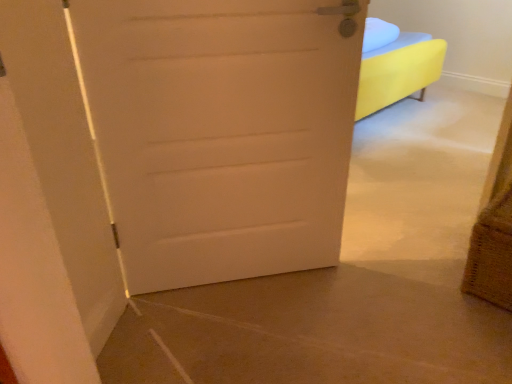
Question: Can you confirm if white matte door at center is shorter than burlap basket at lower right?

Choices:
 (A) yes
 (B) no

Answer: (B)

Question: Does white matte door at center contain burlap basket at lower right?

Choices:
 (A) no
 (B) yes

Answer: (A)

Question: Is white matte door at center behind burlap basket at lower right?

Choices:
 (A) no
 (B) yes

Answer: (A)

Question: Would you consider white matte door at center to be distant from burlap basket at lower right?

Choices:
 (A) yes
 (B) no

Answer: (B)

Question: Is white matte door at center wider than burlap basket at lower right?

Choices:
 (A) yes
 (B) no

Answer: (B)

Question: Is white matte door at center thinner than burlap basket at lower right?

Choices:
 (A) yes
 (B) no

Answer: (A)

Question: Does burlap basket at lower right have a greater width compared to white matte door at center?

Choices:
 (A) no
 (B) yes

Answer: (B)

Question: Is burlap basket at lower right far from white matte door at center?

Choices:
 (A) no
 (B) yes

Answer: (A)

Question: Is burlap basket at lower right oriented towards white matte door at center?

Choices:
 (A) yes
 (B) no

Answer: (B)

Question: Is burlap basket at lower right not inside white matte door at center?

Choices:
 (A) no
 (B) yes

Answer: (B)

Question: Is burlap basket at lower right positioned with its back to white matte door at center?

Choices:
 (A) no
 (B) yes

Answer: (A)

Question: Is burlap basket at lower right at the left side of white matte door at center?

Choices:
 (A) no
 (B) yes

Answer: (A)

Question: Considering the positions of white matte door at center and burlap basket at lower right in the image, is white matte door at center wider or thinner than burlap basket at lower right?

Choices:
 (A) wide
 (B) thin

Answer: (B)